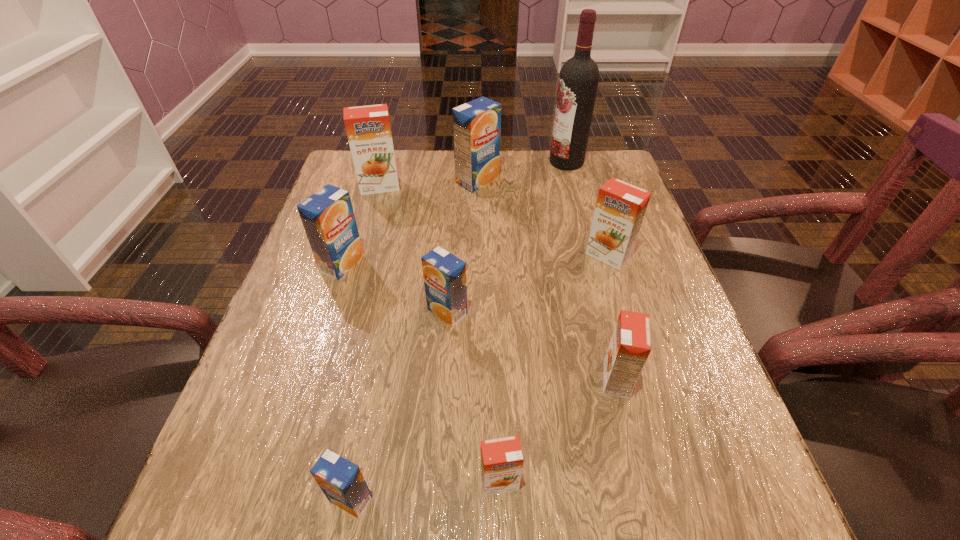
The height and width of the screenshot is (540, 960). Find the location of `free point located 0.350m on the front of the leftmost blue orange_juice`. free point located 0.350m on the front of the leftmost blue orange_juice is located at coordinates (288, 433).

Where is `vacant space located on the front of the third smallest orange orange juice`? The width and height of the screenshot is (960, 540). vacant space located on the front of the third smallest orange orange juice is located at coordinates (660, 427).

This screenshot has width=960, height=540. What are the coordinates of `free space located 0.280m on the front of the second smallest blue orange_juice` in the screenshot? It's located at (437, 471).

The height and width of the screenshot is (540, 960). I want to click on free spot located 0.060m on the left of the third farthest orange orange juice, so click(x=566, y=379).

Find the location of a particular element. Image resolution: width=960 pixels, height=540 pixels. free location located on the right of the nearest blue orange_juice is located at coordinates (441, 499).

Identify the location of vacant region located 0.060m on the back of the smallest orange orange juice. This screenshot has height=540, width=960. (498, 430).

Locate an element on the screen. Image resolution: width=960 pixels, height=540 pixels. wine bottle located in the far edge section of the desktop is located at coordinates (578, 80).

Locate an element on the screen. The image size is (960, 540). wine bottle positioned at the right edge is located at coordinates (578, 80).

Identify the location of object present at the far left corner. The height and width of the screenshot is (540, 960). (368, 129).

The height and width of the screenshot is (540, 960). What are the coordinates of `object located in the far right corner section of the desktop` in the screenshot? It's located at (578, 80).